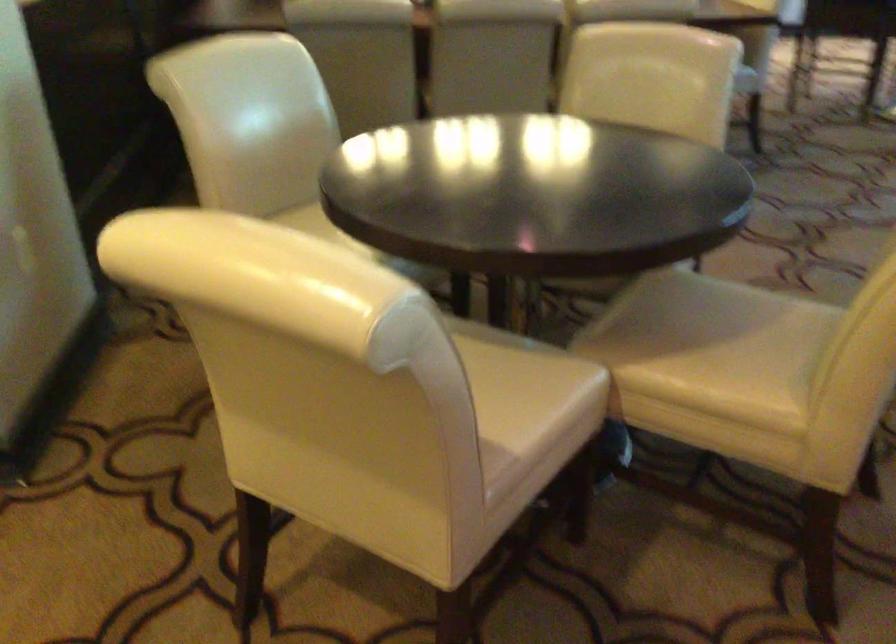
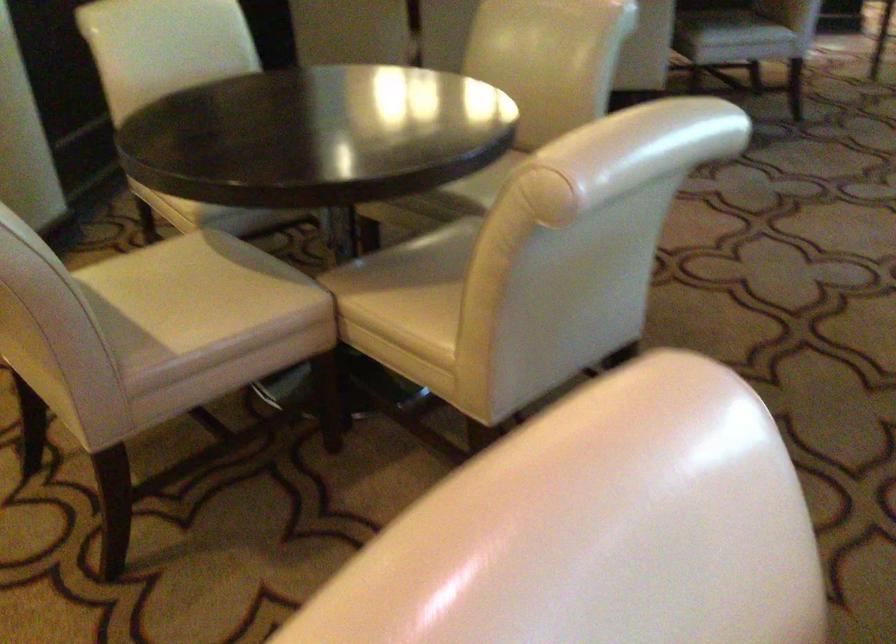
Question: How did the camera likely rotate?

Choices:
 (A) Left
 (B) Right
 (C) Up
 (D) Down

Answer: (A)